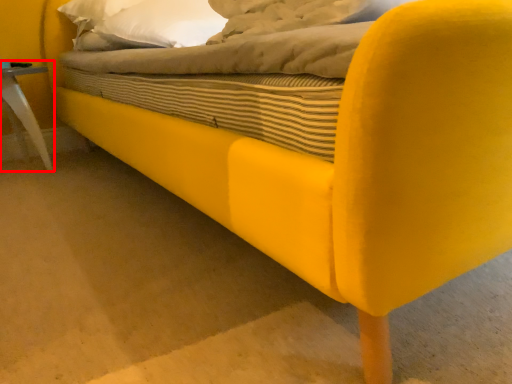
Question: Observing the image, what is the correct spatial positioning of furniture (annotated by the red box) in reference to pillow?

Choices:
 (A) left
 (B) right

Answer: (A)